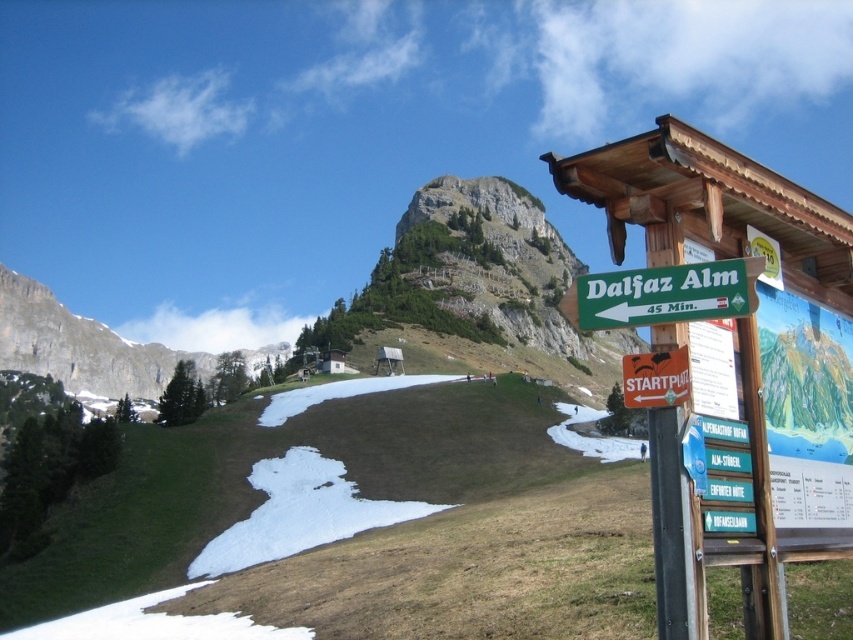
Can you confirm if wooden signpost at upper right is wider than white plastic sign at center-right?

Yes, wooden signpost at upper right is wider than white plastic sign at center-right.

Which is more to the right, wooden signpost at upper right or white plastic sign at center-right?

wooden signpost at upper right

What do you see at coordinates (712, 209) in the screenshot? I see `wooden signpost at upper right` at bounding box center [712, 209].

Where is `wooden signpost at upper right`? The image size is (853, 640). wooden signpost at upper right is located at coordinates (712, 209).

Can you confirm if green plastic map at right is positioned below white plastic sign at center-right?

Yes, green plastic map at right is below white plastic sign at center-right.

How far apart are green plastic map at right and white plastic sign at center-right?

green plastic map at right and white plastic sign at center-right are 24.01 feet apart.

You are a GUI agent. You are given a task and a screenshot of the screen. Output one action in this format:
    pyautogui.click(x=<x>, y=<y>)
    Task: Click on the green plastic map at right
    
    Given the screenshot: What is the action you would take?
    pyautogui.click(x=805, y=410)

Does wooden signpost at upper right have a greater width compared to green plastic map at right?

Yes, wooden signpost at upper right is wider than green plastic map at right.

Is wooden signpost at upper right taller than green plastic map at right?

Indeed, wooden signpost at upper right has a greater height compared to green plastic map at right.

Is point (775, 621) more distant than point (787, 330)?

No, it is not.

You are a GUI agent. You are given a task and a screenshot of the screen. Output one action in this format:
    pyautogui.click(x=<x>, y=<y>)
    Task: Click on the wooden signpost at upper right
    The width and height of the screenshot is (853, 640).
    Given the screenshot: What is the action you would take?
    pyautogui.click(x=712, y=209)